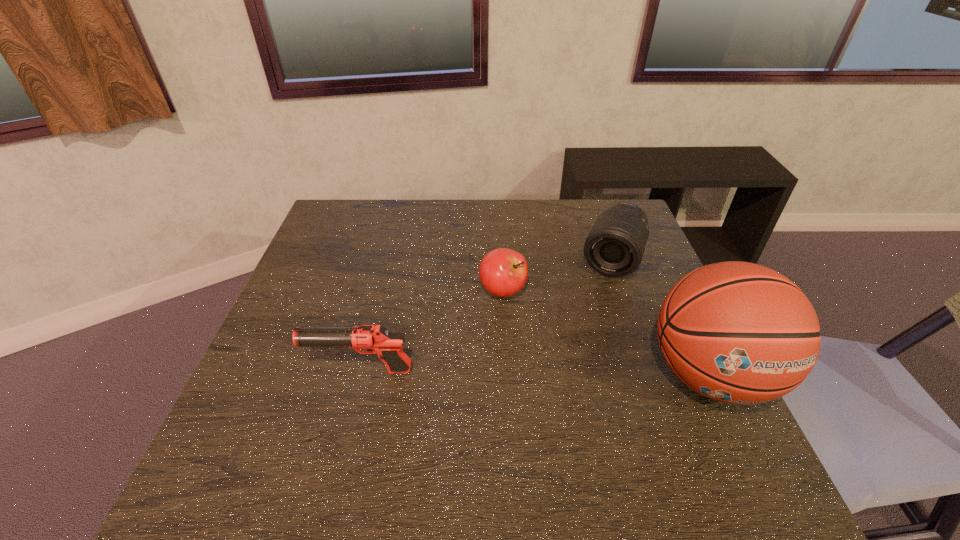
Where is `free space on the desktop that is between the leftmost object and the basketball and is positioned on the stem of the second object from left to right`? This screenshot has width=960, height=540. free space on the desktop that is between the leftmost object and the basketball and is positioned on the stem of the second object from left to right is located at coordinates (x=532, y=373).

You are a GUI agent. You are given a task and a screenshot of the screen. Output one action in this format:
    pyautogui.click(x=<x>, y=<y>)
    Task: Click on the vacant space on the desktop that is between the leftmost object and the basketball and is positioned on the surface of the telephoto lens
    
    Given the screenshot: What is the action you would take?
    pyautogui.click(x=566, y=373)